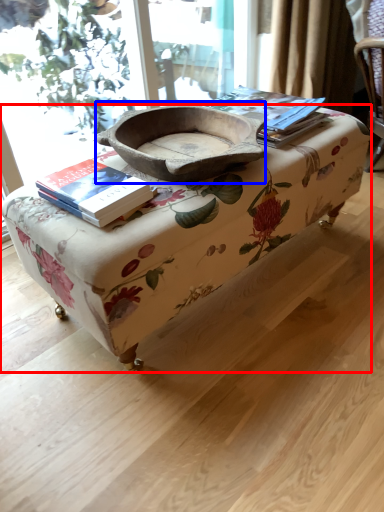
Question: Which object is further to the camera taking this photo, table (highlighted by a red box) or bowl (highlighted by a blue box)?

Choices:
 (A) table
 (B) bowl

Answer: (B)